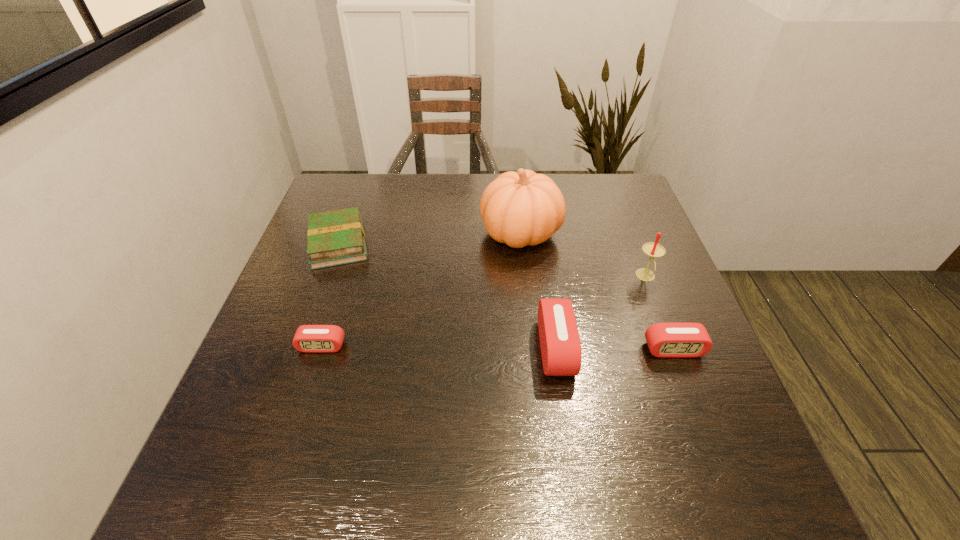
In the image, there is a desktop. At what (x,y) coordinates should I click in order to perform the action: click on vacant space at the near edge. Please return your answer as a coordinate pair (x, y). This screenshot has height=540, width=960. Looking at the image, I should click on pos(344,423).

Identify the location of blank space at the left edge of the desktop. This screenshot has height=540, width=960. (313, 313).

I want to click on free location at the right edge, so click(x=661, y=313).

Identify the location of vacant space at the far left corner of the desktop. This screenshot has width=960, height=540. (331, 207).

What are the coordinates of `vacant region at the far right corner of the desktop` in the screenshot? It's located at (600, 189).

Locate an element on the screen. free space between the book and the second shortest alarm clock is located at coordinates (506, 296).

Where is `free point between the leftmost alarm clock and the fourth tallest object`? The image size is (960, 540). free point between the leftmost alarm clock and the fourth tallest object is located at coordinates (497, 348).

Where is `free space between the leftmost alarm clock and the fifth shortest object`? This screenshot has width=960, height=540. free space between the leftmost alarm clock and the fifth shortest object is located at coordinates (484, 312).

The height and width of the screenshot is (540, 960). Find the location of `vacant area that lies between the book and the tallest object`. vacant area that lies between the book and the tallest object is located at coordinates (429, 238).

Find the location of a particular element. free space that is in between the pumpkin and the candle is located at coordinates (583, 255).